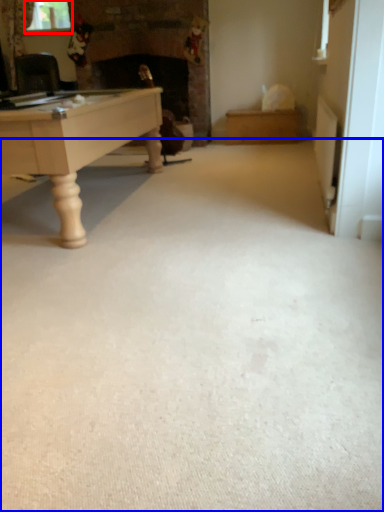
Question: Which object is further to the camera taking this photo, window screen (highlighted by a red box) or plain (highlighted by a blue box)?

Choices:
 (A) window screen
 (B) plain

Answer: (A)